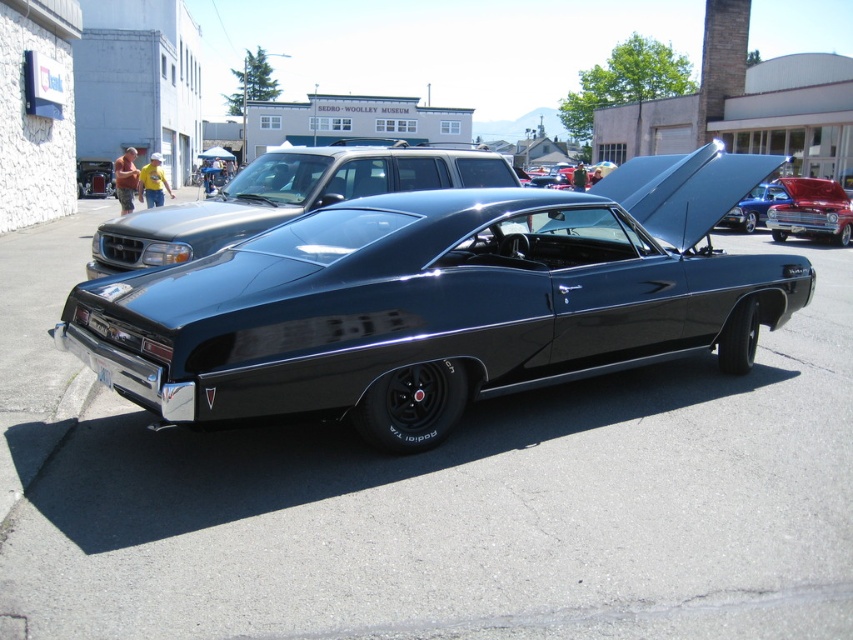
Question: Which is nearer to the glossy black car at center?

Choices:
 (A) shiny red car at upper right
 (B) shiny black muscle car at center

Answer: (B)

Question: Is shiny black muscle car at center in front of glossy black car at center?

Choices:
 (A) no
 (B) yes

Answer: (B)

Question: Which point is closer to the camera?

Choices:
 (A) glossy black car at center
 (B) shiny red car at upper right

Answer: (A)

Question: In this image, where is shiny black muscle car at center located relative to glossy black car at center?

Choices:
 (A) below
 (B) above

Answer: (A)

Question: Observing the image, what is the correct spatial positioning of glossy black car at center in reference to shiny red car at upper right?

Choices:
 (A) right
 (B) left

Answer: (B)

Question: Considering the real-world distances, which object is farthest from the shiny black muscle car at center?

Choices:
 (A) shiny red car at upper right
 (B) glossy black car at center

Answer: (A)